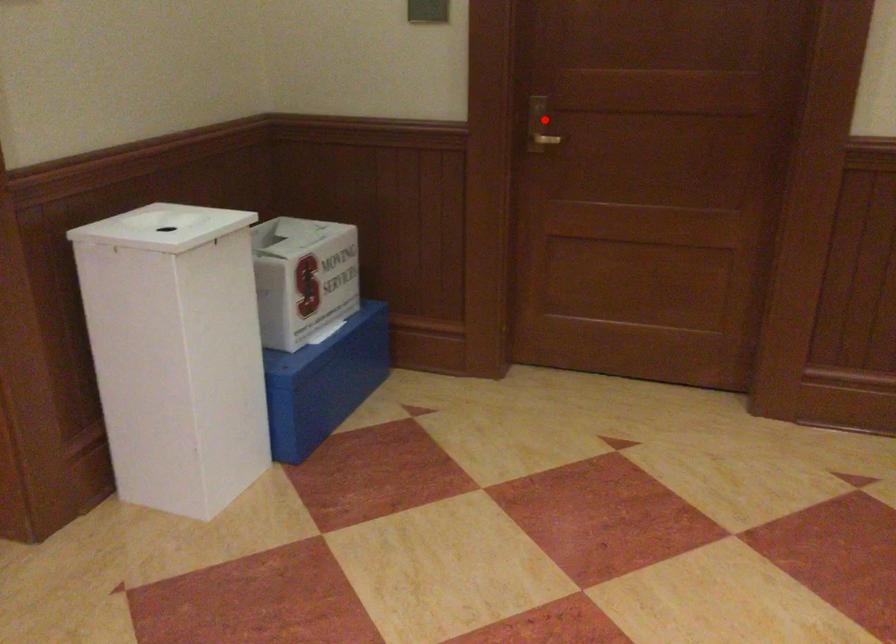
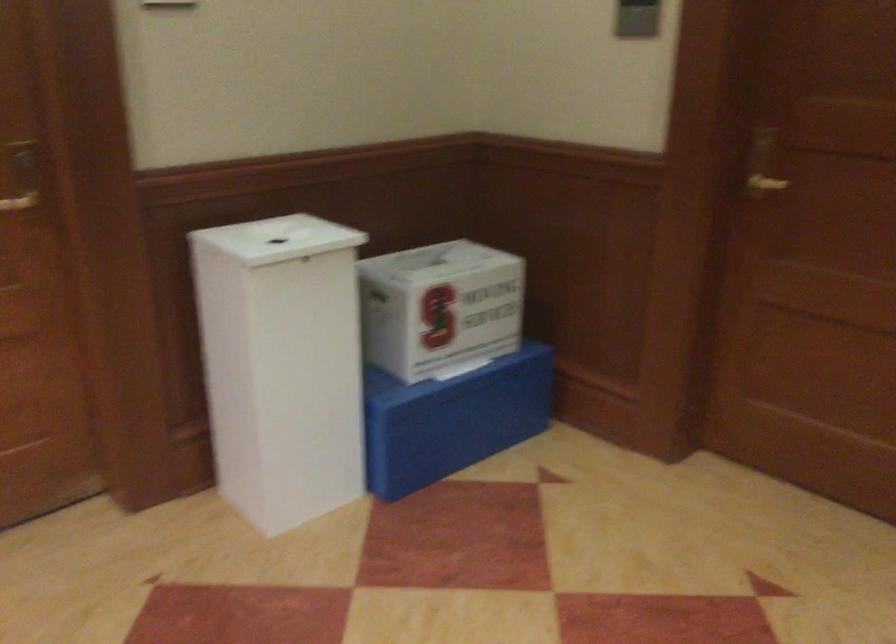
In the second image, find the point that corresponds to the highlighted location in the first image.

(762, 164)